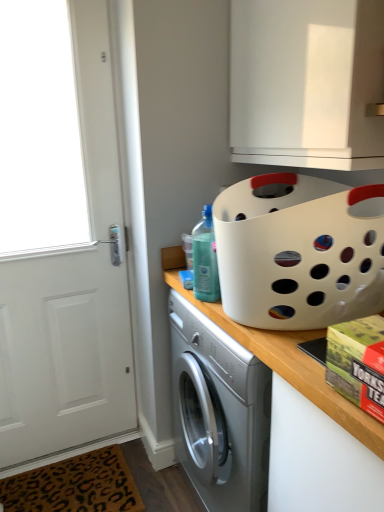
Question: Does white plastic basket at upper right have a larger size compared to white matte door at left?

Choices:
 (A) no
 (B) yes

Answer: (A)

Question: Does white plastic basket at upper right have a lesser width compared to white matte door at left?

Choices:
 (A) no
 (B) yes

Answer: (A)

Question: Considering the relative positions of white plastic basket at upper right and white matte door at left in the image provided, is white plastic basket at upper right to the left of white matte door at left from the viewer's perspective?

Choices:
 (A) no
 (B) yes

Answer: (A)

Question: From a real-world perspective, is white plastic basket at upper right over white matte door at left?

Choices:
 (A) yes
 (B) no

Answer: (A)

Question: Considering the relative sizes of white plastic basket at upper right and white matte door at left in the image provided, is white plastic basket at upper right smaller than white matte door at left?

Choices:
 (A) no
 (B) yes

Answer: (B)

Question: Is white matte countertop at center taller or shorter than white matte door at left?

Choices:
 (A) short
 (B) tall

Answer: (A)

Question: From the image's perspective, relative to white matte door at left, is white matte countertop at center above or below?

Choices:
 (A) below
 (B) above

Answer: (A)

Question: From a real-world perspective, is white matte countertop at center physically located above or below white matte door at left?

Choices:
 (A) above
 (B) below

Answer: (B)

Question: Is white matte countertop at center spatially inside white matte door at left, or outside of it?

Choices:
 (A) outside
 (B) inside

Answer: (A)

Question: Considering their positions, is white matte countertop at center located in front of or behind white matte cabinet at upper center?

Choices:
 (A) front
 (B) behind

Answer: (B)

Question: Considering the positions of point (297, 373) and point (322, 159), is point (297, 373) closer or farther from the camera than point (322, 159)?

Choices:
 (A) farther
 (B) closer

Answer: (B)

Question: Is white matte countertop at center wider or thinner than white matte cabinet at upper center?

Choices:
 (A) thin
 (B) wide

Answer: (B)

Question: In terms of height, does white matte countertop at center look taller or shorter compared to white matte cabinet at upper center?

Choices:
 (A) tall
 (B) short

Answer: (A)

Question: In the image, is green matte box at lower right on the left side or the right side of white matte cabinet at upper center?

Choices:
 (A) left
 (B) right

Answer: (A)

Question: Which is correct: green matte box at lower right is inside white matte cabinet at upper center, or outside of it?

Choices:
 (A) inside
 (B) outside

Answer: (B)